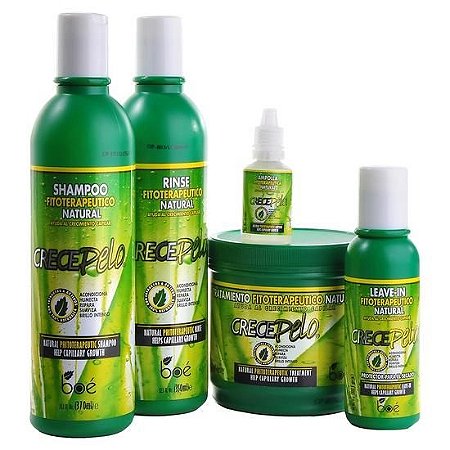
Image resolution: width=450 pixels, height=450 pixels. I want to click on bottle, so click(389, 299), click(265, 192), click(149, 184), click(100, 199).